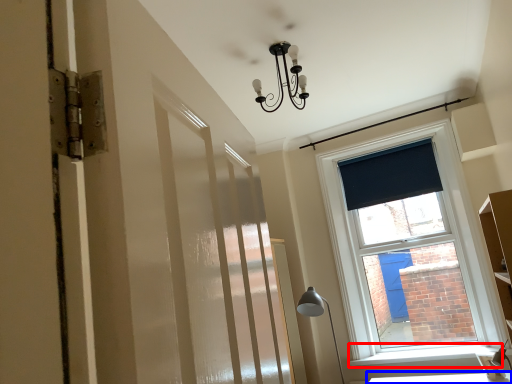
Question: Among these objects, which one is nearest to the camera, window sill (highlighted by a red box) or table (highlighted by a blue box)?

Choices:
 (A) window sill
 (B) table

Answer: (B)